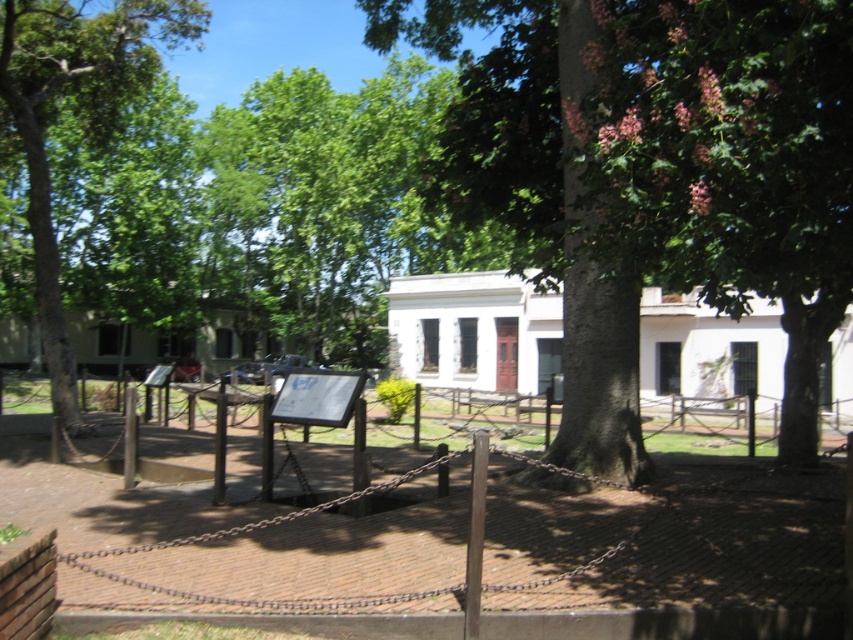
You are standing at the center of the brick pathway in the park. You see a wooden fence at center with a point marked at coordinate [670,563]. Is this point located on the wooden fence at center?

Yes, the point 0.887, 0.787 is on the wooden fence at center.

Based on the photo, you are standing in the park and want to take a photo of the wooden fence at center and the green leafy tree at left. Which object should you focus on first to ensure both are in the frame?

You should focus on the wooden fence at center first since it is closer to you than the green leafy tree at left, ensuring both are in the frame by adjusting the camera angle accordingly.